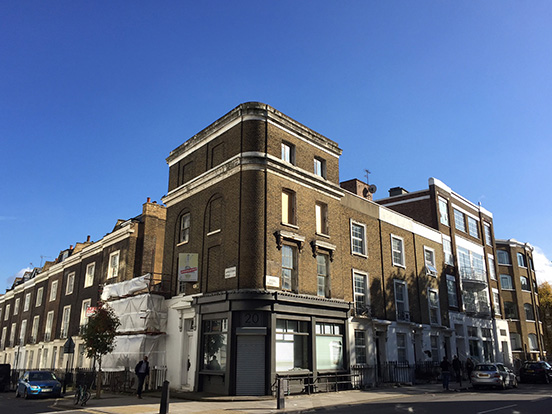
The height and width of the screenshot is (414, 552). Find the location of `front door`. front door is located at coordinates (248, 355).